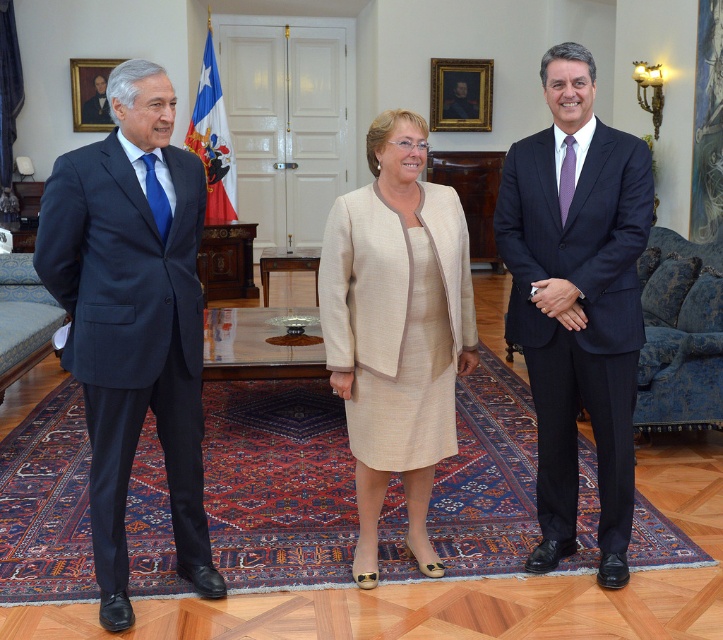
Question: Is matte black suit at left to the right of beige textured suit at center from the viewer's perspective?

Choices:
 (A) yes
 (B) no

Answer: (B)

Question: Which object appears closest to the camera in this image?

Choices:
 (A) beige textured suit at center
 (B) matte black suit at left
 (C) dark blue suit at right

Answer: (B)

Question: Observing the image, what is the correct spatial positioning of matte black suit at left in reference to dark blue suit at right?

Choices:
 (A) right
 (B) left

Answer: (B)

Question: Is matte black suit at left further to camera compared to beige textured suit at center?

Choices:
 (A) yes
 (B) no

Answer: (B)

Question: Among these points, which one is nearest to the camera?

Choices:
 (A) (372, 465)
 (B) (100, 305)

Answer: (B)

Question: Which object is positioned closest to the matte black suit at left?

Choices:
 (A) beige textured suit at center
 (B) dark blue suit at right

Answer: (A)